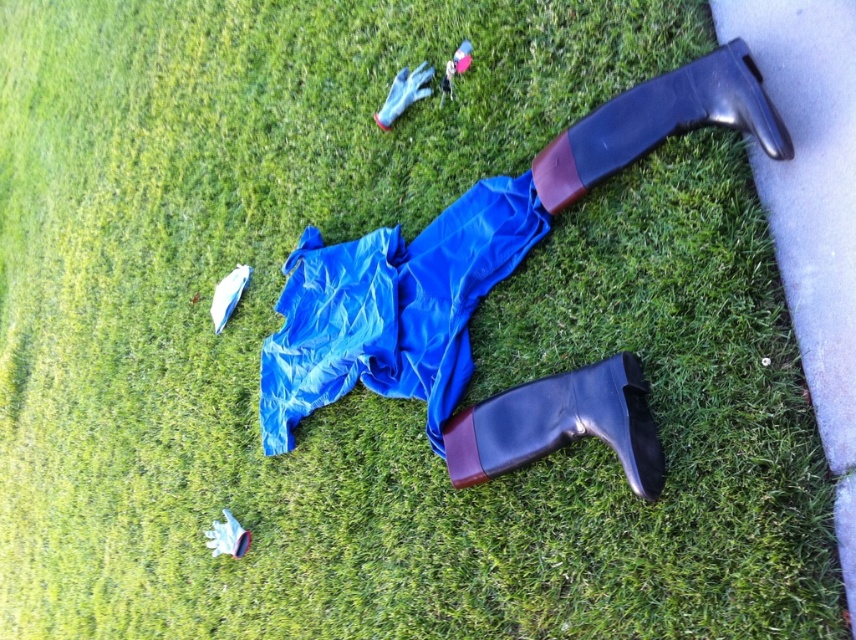
You are standing at the point marked by the coordinates point [559,424]. Looking around, you see a pair of blue rubber gloves and a blue rubber jumpsuit. Which object is closer to your current position?

The shiny black boot at lower center is located at point [559,424]. The blue rubber gloves are positioned near the top left corner, while the jumpsuit is spread out towards the center and bottom. Since the jumpsuit is closer to the lower center area where the boot is, the jumpsuit is closer to your current position.